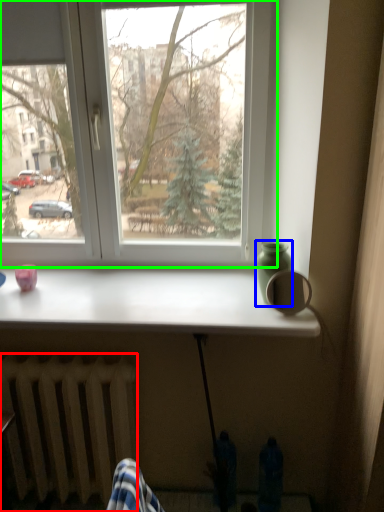
Question: Estimate the real-world distances between objects in this image. Which object is farther from radiator (highlighted by a red box), glass vase (highlighted by a blue box) or window (highlighted by a green box)?

Choices:
 (A) glass vase
 (B) window

Answer: (A)